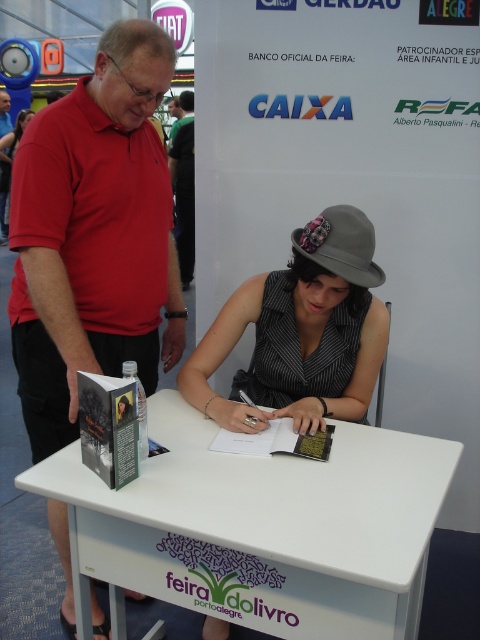
Does point (313, 358) lie in front of point (29, 115)?

Yes, point (313, 358) is closer to viewer.

Is gray felt hat at center to the right of matte black dress at center from the viewer's perspective?

Yes, gray felt hat at center is to the right of matte black dress at center.

Who is more distant from viewer, (299, 264) or (8, 166)?

The point (8, 166) is more distant.

Locate an element on the screen. gray felt hat at center is located at coordinates (301, 332).

Does point (276, 541) lie behind point (213, 408)?

No, it is in front of (213, 408).

Can you confirm if white plastic table at center is positioned to the right of gray felt hat at center?

No, white plastic table at center is not to the right of gray felt hat at center.

Image resolution: width=480 pixels, height=640 pixels. Describe the element at coordinates (262, 525) in the screenshot. I see `white plastic table at center` at that location.

Find the location of a particular element. The image size is (480, 640). white plastic table at center is located at coordinates (262, 525).

The image size is (480, 640). In order to click on matte red polo shirt at left in this screenshot , I will do (x=94, y=236).

Does matte red polo shirt at left have a smaller size compared to matte black dress at center?

Yes.

Who is more distant from viewer, [58,241] or [19,140]?

The point [19,140] is more distant.

Where is `matte red polo shirt at left`? The image size is (480, 640). matte red polo shirt at left is located at coordinates (94, 236).